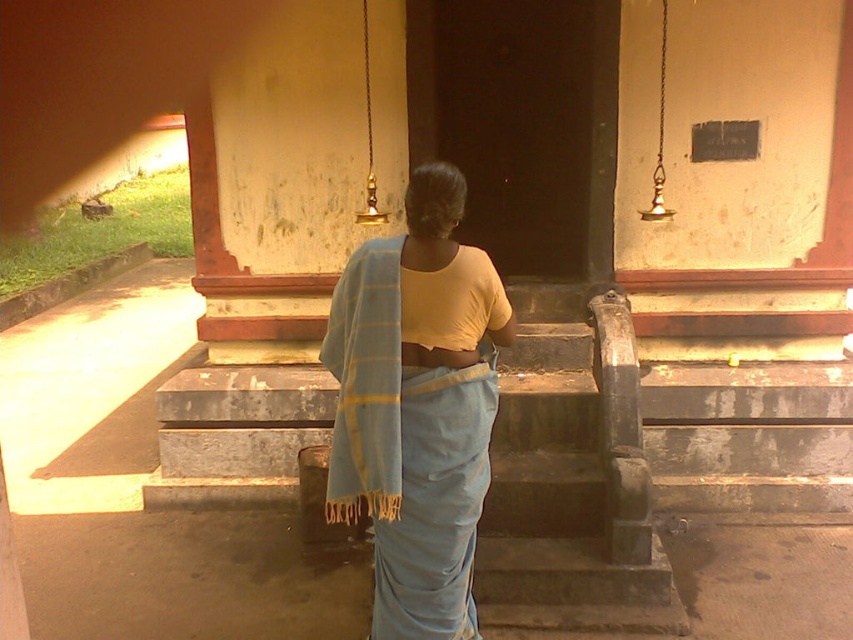
Does light blue fabric at center have a lesser height compared to light blue woven shawl at center?

In fact, light blue fabric at center may be taller than light blue woven shawl at center.

Is point (340, 410) positioned before point (337, 420)?

Yes, point (340, 410) is closer to viewer.

I want to click on light blue fabric at center, so click(x=416, y=406).